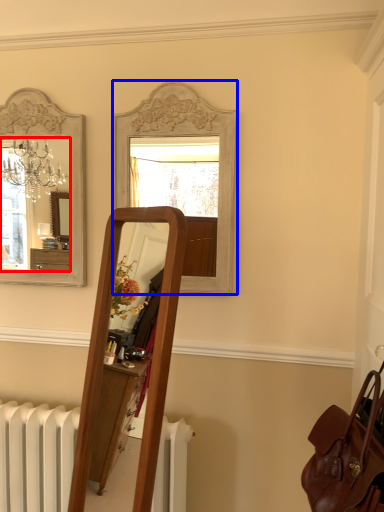
Question: Among these objects, which one is farthest to the camera, mirror (highlighted by a red box) or mirror (highlighted by a blue box)?

Choices:
 (A) mirror
 (B) mirror

Answer: (A)